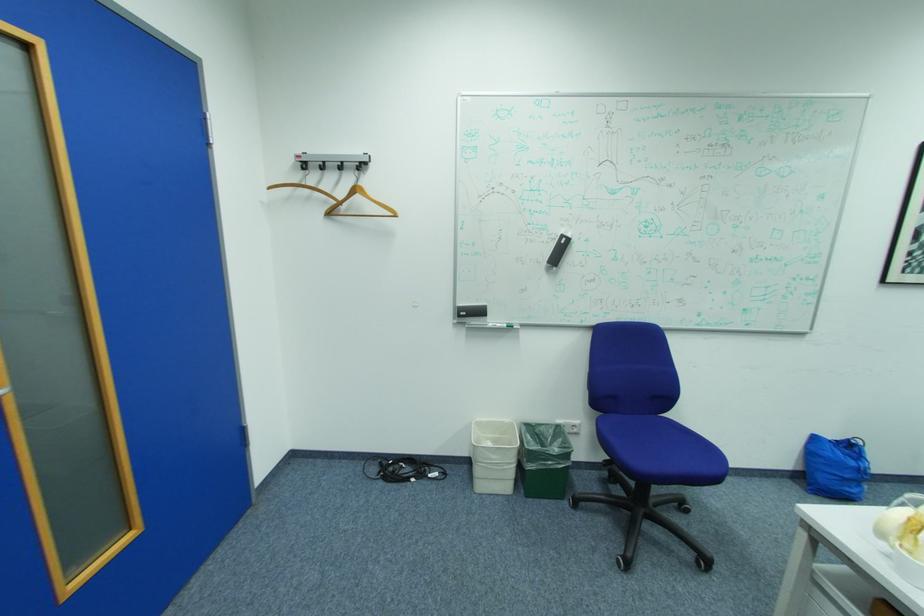
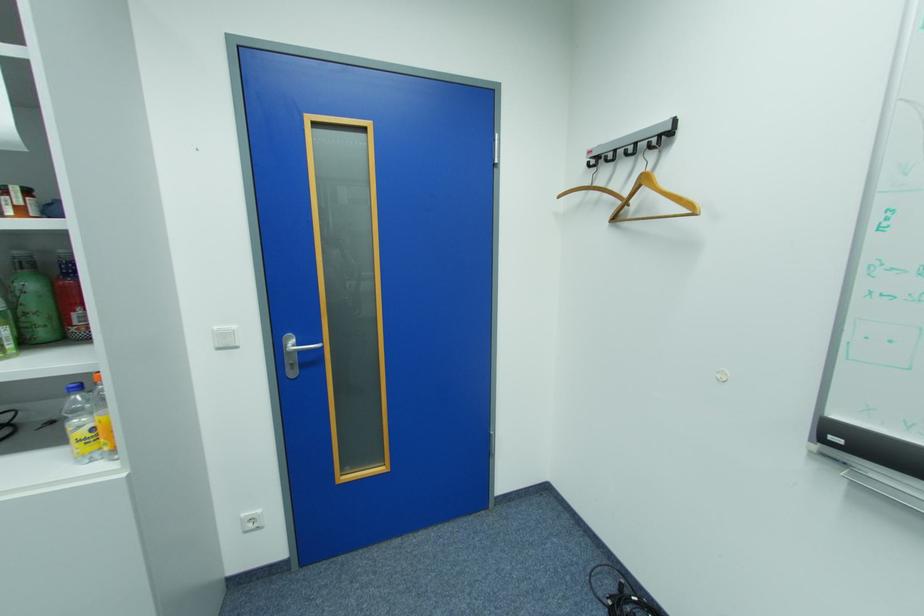
Find the pixel in the second image that matches (x=337, y=214) in the first image.

(624, 220)